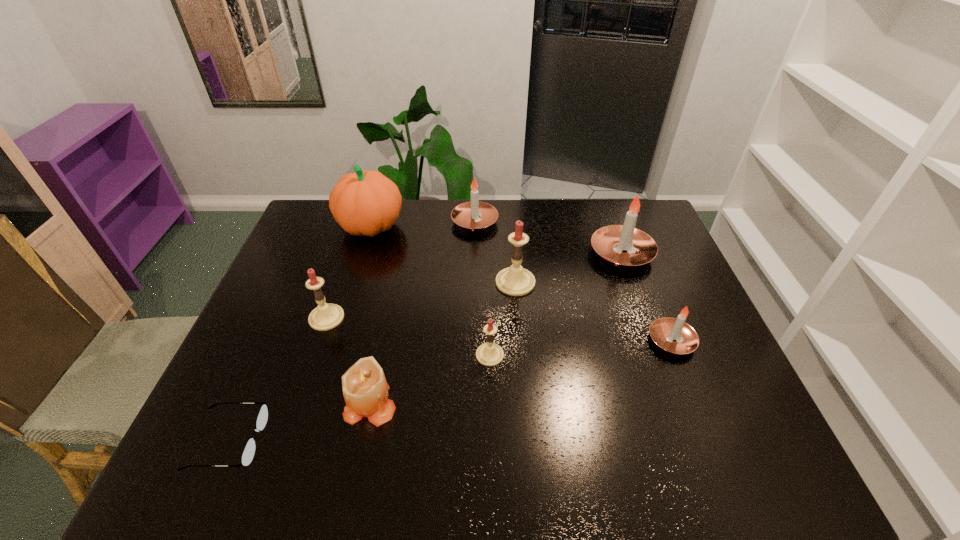
The width and height of the screenshot is (960, 540). What are the coordinates of `vacant space located on the lenses of the shortest object` in the screenshot? It's located at (411, 441).

At what (x,y) coordinates should I click in order to perform the action: click on pumpkin that is at the far edge. Please return your answer as a coordinate pair (x, y). This screenshot has height=540, width=960. Looking at the image, I should click on [x=364, y=202].

Identify the location of object situated at the near edge. [x=248, y=453].

At what (x,y) coordinates should I click in order to perform the action: click on pumpkin at the left edge. Please return your answer as a coordinate pair (x, y). Looking at the image, I should click on (364, 202).

Where is `candle that is at the left edge`? The height and width of the screenshot is (540, 960). candle that is at the left edge is located at coordinates (325, 316).

Identify the location of spectacles that is at the left edge. (248, 453).

Locate an element on the screen. The height and width of the screenshot is (540, 960). object that is at the far left corner is located at coordinates (364, 202).

Where is `object present at the near left corner`? object present at the near left corner is located at coordinates (248, 453).

Find the location of a particular element. object that is positioned at the far right corner is located at coordinates (624, 245).

Where is `vacant area at the far edge`? vacant area at the far edge is located at coordinates (557, 224).